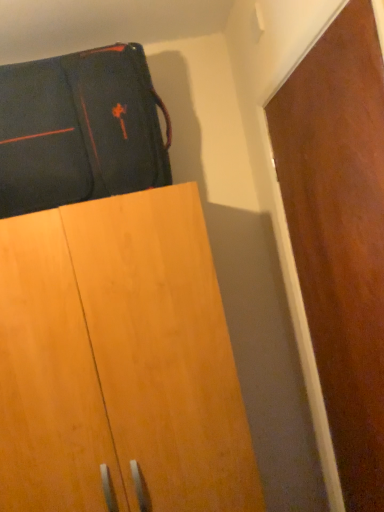
The width and height of the screenshot is (384, 512). In order to click on matte black suitcase at upper left in this screenshot , I will do `click(80, 129)`.

What is the approximate height of matte black suitcase at upper left?

The height of matte black suitcase at upper left is 21.25 inches.

What do you see at coordinates (80, 129) in the screenshot? The width and height of the screenshot is (384, 512). I see `matte black suitcase at upper left` at bounding box center [80, 129].

What is the approximate width of matte black suitcase at upper left?

It is 15.52 inches.

Where is `matte black suitcase at upper left`? This screenshot has height=512, width=384. matte black suitcase at upper left is located at coordinates (80, 129).